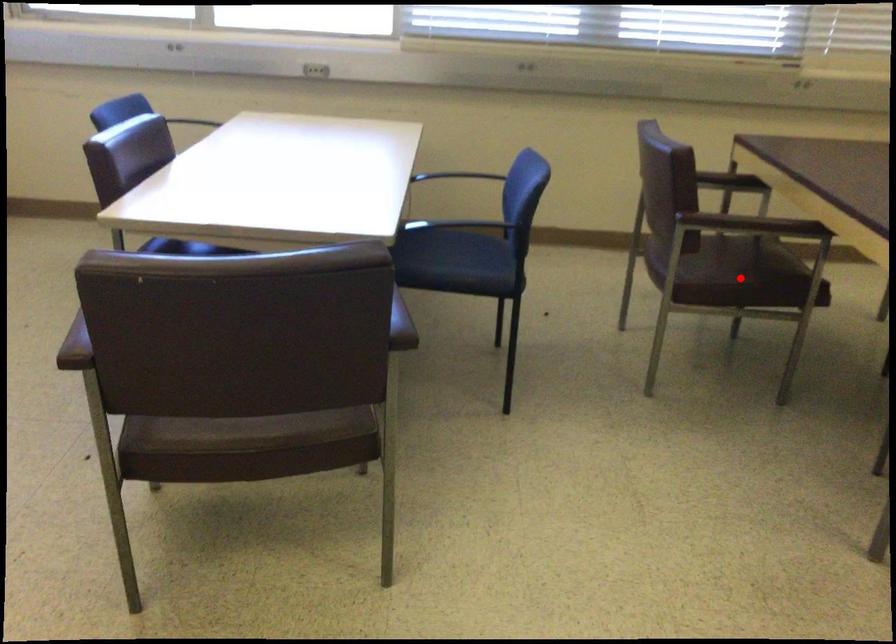
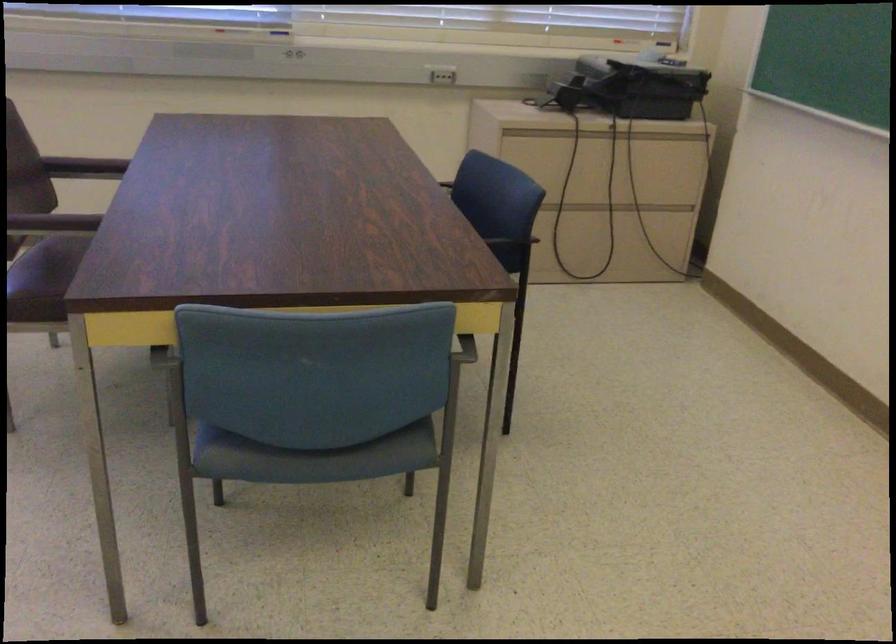
Question: I am providing you with two images of the same scene from different viewpoints. A red point is marked on the first image. Can you still see the location of the red point in image 2?

Choices:
 (A) Yes
 (B) No

Answer: (B)